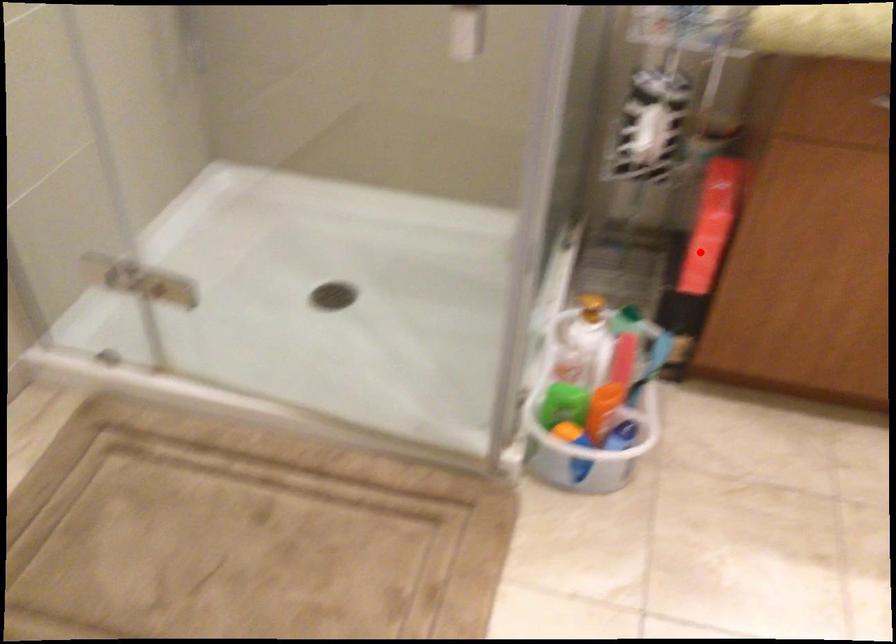
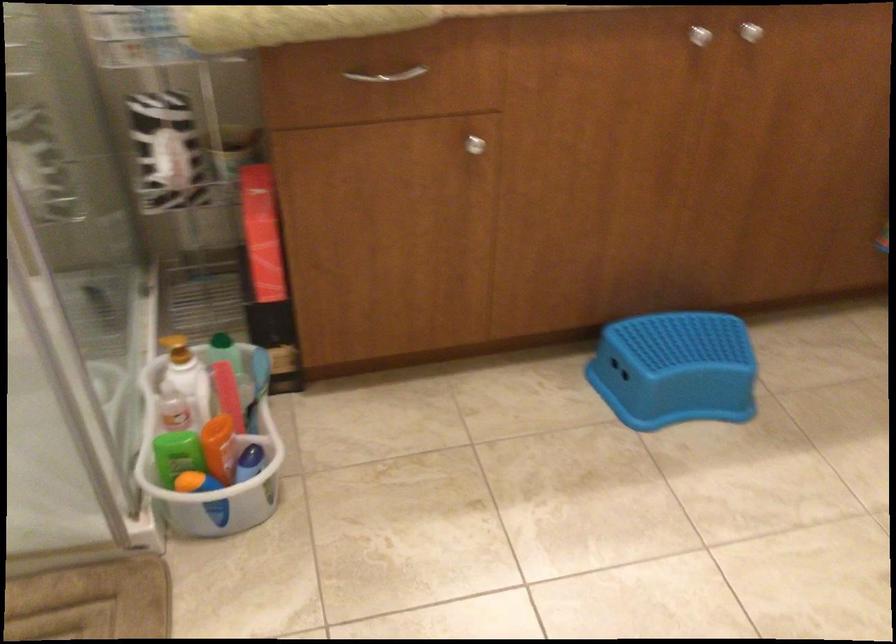
Find the pixel in the second image that matches the highlighted location in the first image.

(264, 263)